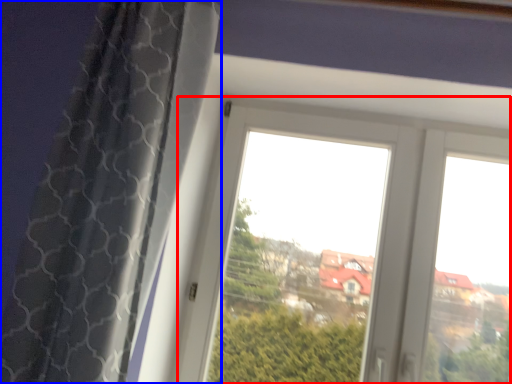
Question: Among these objects, which one is farthest to the camera, window (highlighted by a red box) or curtain (highlighted by a blue box)?

Choices:
 (A) window
 (B) curtain

Answer: (A)